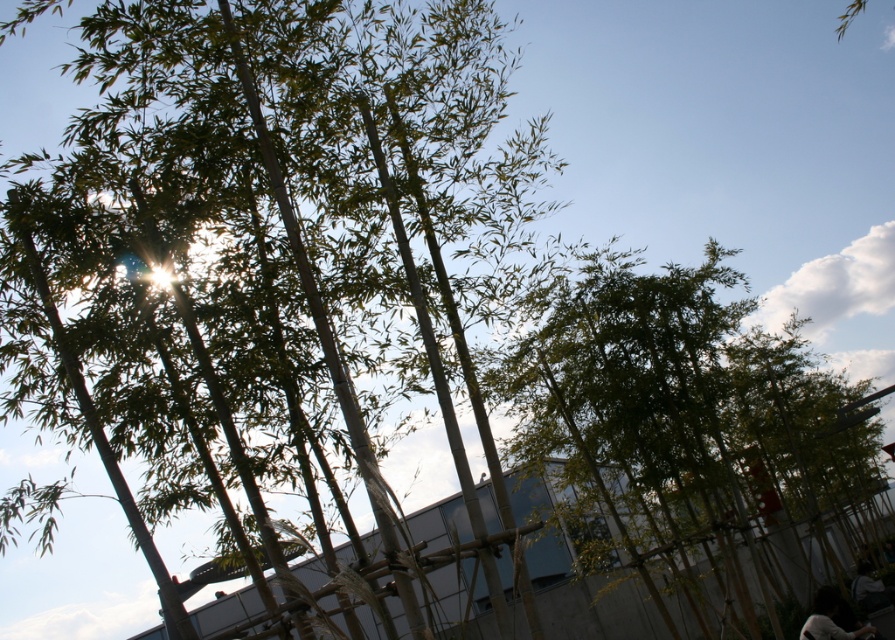
You are a delivery person standing at the entrance of the modern building. You need to hand over a package to someone who is near the dark hair at lower right and dark gray fabric bag at lower right. However, you must stay at least 6 feet away from them due to safety guidelines. Can you safely approach and deliver the package without violating the distance requirement?

The distance between dark hair at lower right and dark gray fabric bag at lower right is 17.91 feet, so yes, you can safely approach and deliver the package while maintaining the required 6 feet distance since the existing distance is much greater than the minimum requirement.

You are standing in a bamboo garden and want to take a photo of a specific point located at coordinates point (632, 493). Your camera has a maximum focus range of 15 meters. Will the camera be able to focus on that point?

The distance of point (632, 493) from camera is 14.48 meters, which is within the camera maximum focus range of 15 meters. So yes, the camera can focus on that point.